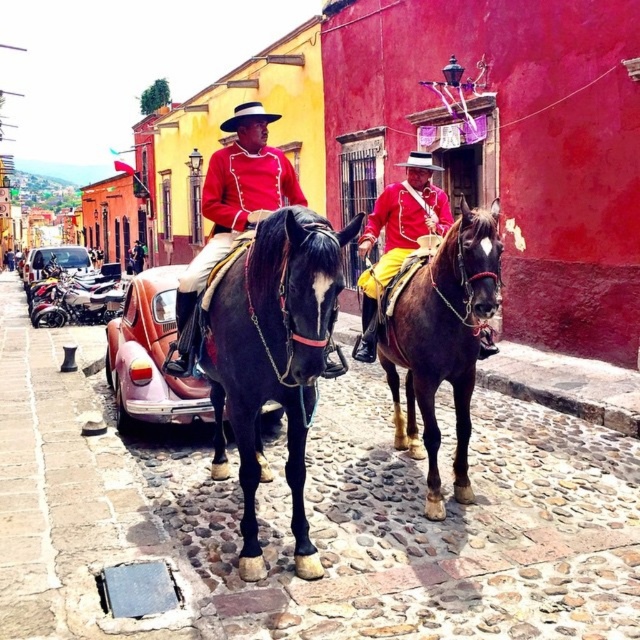
Question: Does brown glossy horse at center have a larger size compared to shiny red uniform at center?

Choices:
 (A) yes
 (B) no

Answer: (A)

Question: Which point is closer to the camera taking this photo?

Choices:
 (A) pos(179,337)
 (B) pos(378,358)
 (C) pos(371,348)
 (D) pos(29,280)

Answer: (A)

Question: Can you confirm if shiny red uniform at center is positioned to the right of shiny gold pants at center?

Choices:
 (A) yes
 (B) no

Answer: (B)

Question: Which is farther from the pink matte car at center?

Choices:
 (A) shiny gold pants at center
 (B) shiny red uniform at center
 (C) metallic pink car at center-left
 (D) brown glossy horse at center

Answer: (C)

Question: Among these points, which one is farthest from the camera?

Choices:
 (A) (284, 161)
 (B) (438, 189)
 (C) (218, 445)

Answer: (B)

Question: Does shiny red uniform at center come behind shiny gold pants at center?

Choices:
 (A) yes
 (B) no

Answer: (B)